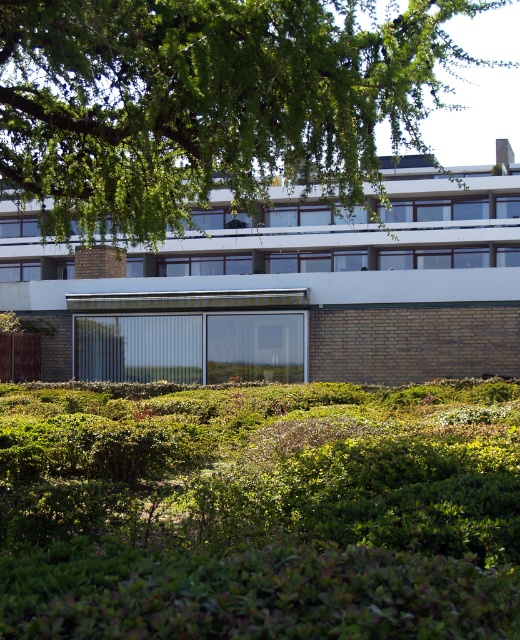
Find the location of a particular element. Image resolution: width=520 pixels, height=640 pixels. green leafy hedge at lower center is located at coordinates (260, 509).

Is green leafy hedge at lower center taller than green leafy tree at upper center?

Incorrect, green leafy hedge at lower center's height is not larger of green leafy tree at upper center's.

This screenshot has width=520, height=640. I want to click on green leafy hedge at lower center, so click(x=260, y=509).